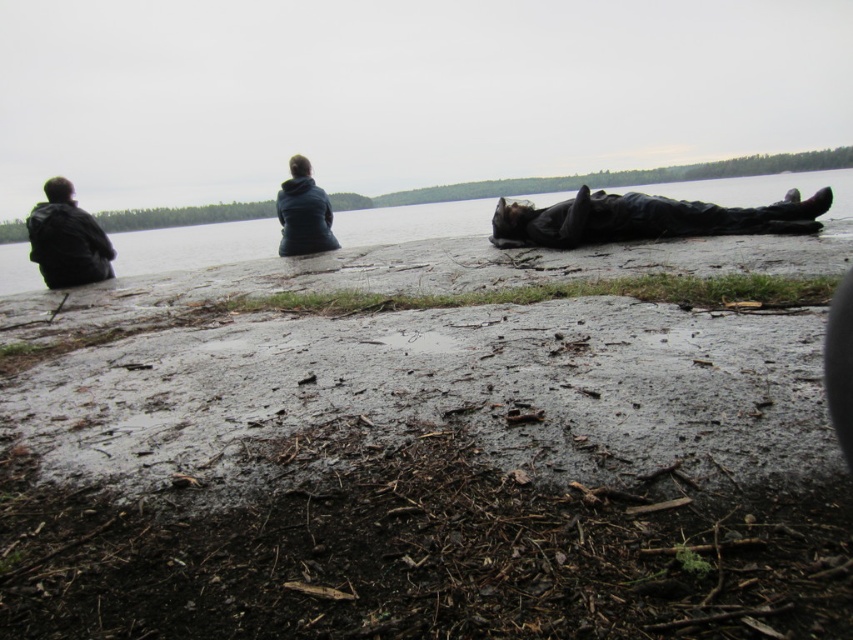
You are standing at the lakeside and want to walk from the matte blue jacket at upper center to the clear water at center. Which direction should you move in?

You should move to the right to reach the clear water at center from the matte blue jacket at upper center since the clear water at center is to the right of the matte blue jacket at upper center.

You are standing on the muddy ground in the foreground and want to walk to the clear water at center without getting your shoes too dirty. Which direction should you walk relative to the matte black jacket at left?

To reach the clear water at center without getting your shoes too dirty, you should walk towards the right side of the matte black jacket at left, as the clear water at center is positioned on the right side of the matte black jacket at left.